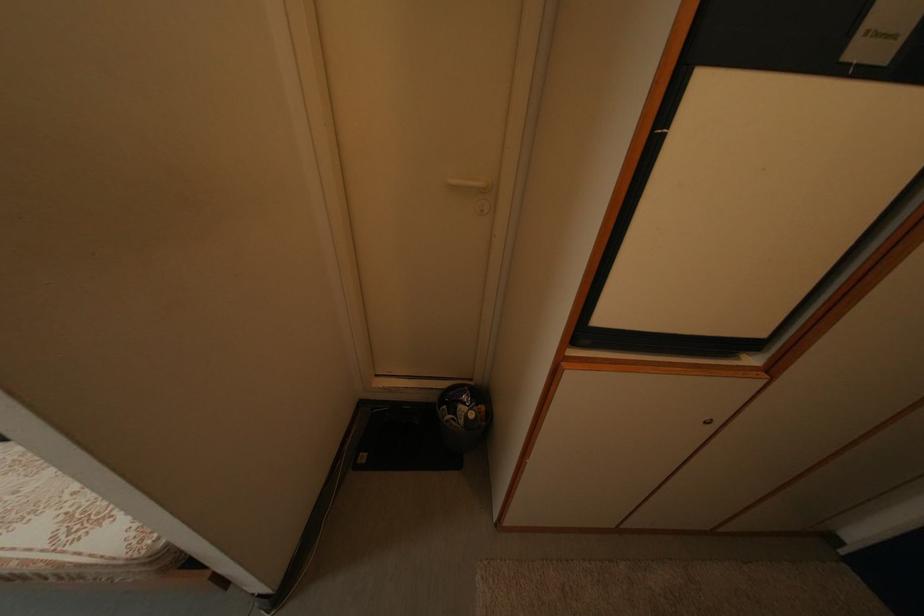
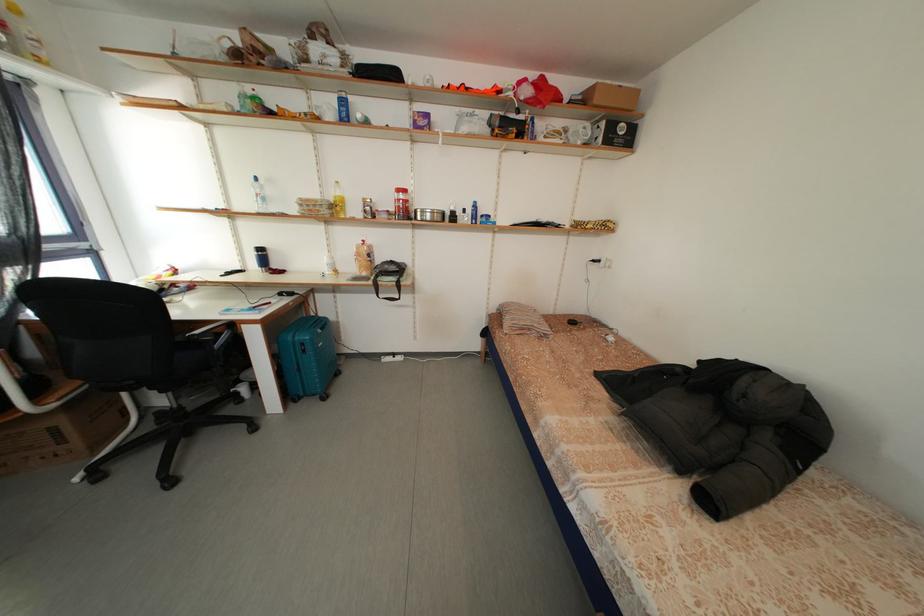
Question: What movement of the cameraman would produce the second image?

Choices:
 (A) Left
 (B) Right
 (C) Forward
 (D) Backward

Answer: (A)